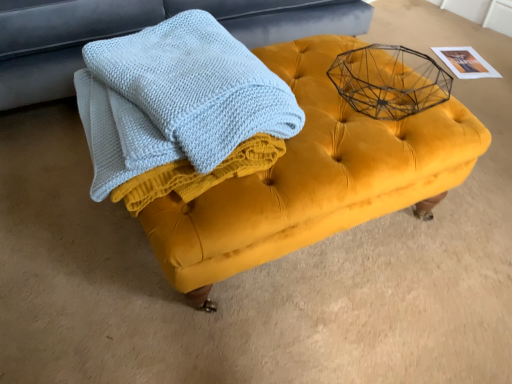
The height and width of the screenshot is (384, 512). Identify the location of velvet yellow ottoman at center. (313, 177).

The width and height of the screenshot is (512, 384). What are the coordinates of `velvet yellow ottoman at center` in the screenshot? It's located at (313, 177).

Is light blue knitted towel at center bigger than velvet yellow ottoman at center?

Incorrect, light blue knitted towel at center is not larger than velvet yellow ottoman at center.

From the image's perspective, is light blue knitted towel at center above or below velvet yellow ottoman at center?

From the image's perspective, light blue knitted towel at center appears below velvet yellow ottoman at center.

Is light blue knitted towel at center next to velvet yellow ottoman at center and touching it?

light blue knitted towel at center and velvet yellow ottoman at center are clearly separated.

Is light blue knitted towel at center looking in the opposite direction of velvet yellow ottoman at center?

No, light blue knitted towel at center is not facing away from velvet yellow ottoman at center.

Is velvet yellow ottoman at center inside or outside of light blue knitted towel at center?

velvet yellow ottoman at center is spatially situated outside light blue knitted towel at center.

From the picture: From their relative heights in the image, would you say velvet yellow ottoman at center is taller or shorter than light blue knitted towel at center?

velvet yellow ottoman at center is taller than light blue knitted towel at center.

Is velvet yellow ottoman at center positioned with its back to light blue knitted towel at center?

velvet yellow ottoman at center does not have its back to light blue knitted towel at center.

Is light blue knitted towel at center not close to velvet yellow ottoman at center?

That's not correct — light blue knitted towel at center is a little close to velvet yellow ottoman at center.

From the image's perspective, is light blue knitted towel at center located above or below velvet yellow ottoman at center?

light blue knitted towel at center is situated higher than velvet yellow ottoman at center in the image.

From a real-world perspective, which is physically below, light blue knitted towel at center or velvet yellow ottoman at center?

In real-world perspective, velvet yellow ottoman at center is lower.

Can you confirm if velvet yellow ottoman at center is bigger than velvet yellow ottoman at center?

Correct, velvet yellow ottoman at center is larger in size than velvet yellow ottoman at center.

Are velvet yellow ottoman at center and velvet yellow ottoman at center located far from each other?

velvet yellow ottoman at center is actually quite close to velvet yellow ottoman at center.

Between velvet yellow ottoman at center and velvet yellow ottoman at center, which one has less height?

velvet yellow ottoman at center is shorter.

From the image's perspective, which one is positioned lower, velvet yellow ottoman at center or velvet yellow ottoman at center?

From the image's view, velvet yellow ottoman at center is below.

Consider the image. Is velvet yellow ottoman at center in front of velvet yellow ottoman at center?

Yes.

Is velvet yellow ottoman at center at the back of velvet yellow ottoman at center?

That's not correct — velvet yellow ottoman at center is not looking away from velvet yellow ottoman at center.

Identify the location of furniture that is above the velvet yellow ottoman at center (from a real-world perspective). (140, 29).

Who is bigger, velvet yellow ottoman at center or light blue knitted towel at center?

velvet yellow ottoman at center.

Are velvet yellow ottoman at center and light blue knitted towel at center located far from each other?

No.

From the picture: From a real-world perspective, is velvet yellow ottoman at center below light blue knitted towel at center?

Yes, from a real-world perspective, velvet yellow ottoman at center is under light blue knitted towel at center.

How different are the orientations of velvet yellow ottoman at center and light blue knitted towel at center in degrees?

They differ by 89.5 degrees in their facing directions.

Locate an element on the screen. furniture behind the light blue knitted towel at center is located at coordinates (140, 29).

Identify the location of bath towel in front of the velvet yellow ottoman at center. Image resolution: width=512 pixels, height=384 pixels. (180, 111).

Based on their spatial positions, is velvet yellow ottoman at center or velvet yellow ottoman at center closer to light blue knitted towel at center?

The object closer to light blue knitted towel at center is velvet yellow ottoman at center.

Which object lies further to the anchor point light blue knitted towel at center, velvet yellow ottoman at center or velvet yellow ottoman at center?

Based on the image, velvet yellow ottoman at center appears to be further to light blue knitted towel at center.

Estimate the real-world distances between objects in this image. Which object is closer to velvet yellow ottoman at center, light blue knitted towel at center or velvet yellow ottoman at center?

light blue knitted towel at center.

Based on their spatial positions, is light blue knitted towel at center or velvet yellow ottoman at center closer to velvet yellow ottoman at center?

light blue knitted towel at center is closer to velvet yellow ottoman at center.

Looking at the image, which one is located closer to velvet yellow ottoman at center, velvet yellow ottoman at center or light blue knitted towel at center?

The object closer to velvet yellow ottoman at center is light blue knitted towel at center.

From the image, which object appears to be farther from velvet yellow ottoman at center, velvet yellow ottoman at center or light blue knitted towel at center?

Among the two, velvet yellow ottoman at center is located further to velvet yellow ottoman at center.

At what (x,y) coordinates should I click in order to perform the action: click on bath towel between velvet yellow ottoman at center and velvet yellow ottoman at center in the up-down direction. Please return your answer as a coordinate pair (x, y). The height and width of the screenshot is (384, 512). Looking at the image, I should click on (180, 111).